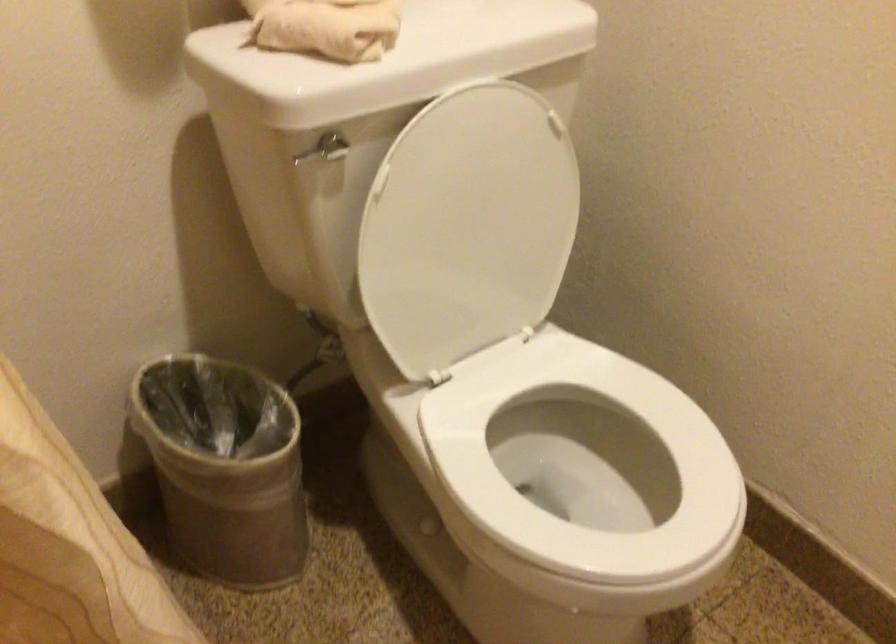
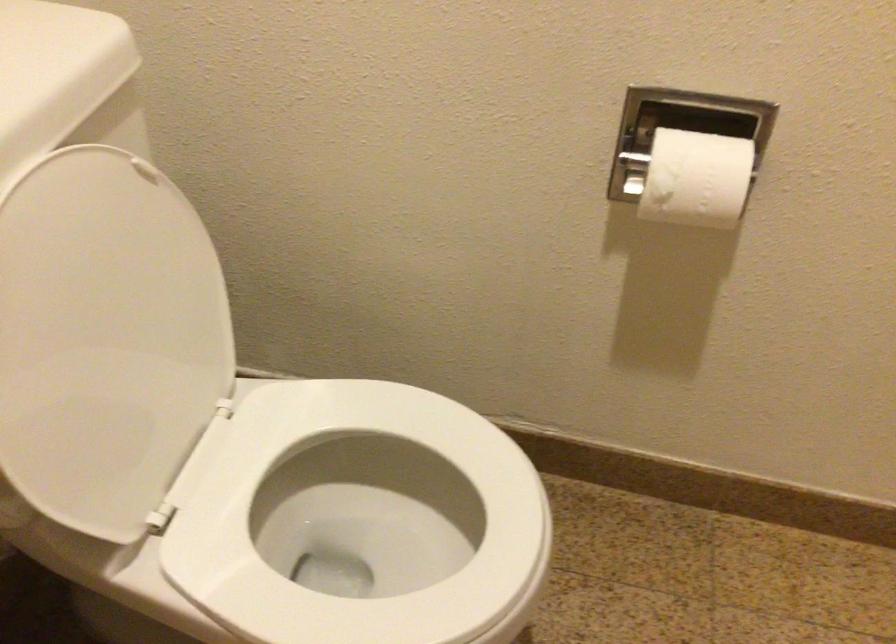
Question: The camera is either moving clockwise (left) or counter-clockwise (right) around the object. The first image is from the beginning of the video and the second image is from the end. Is the camera moving left or right when shooting the video?

Choices:
 (A) Left
 (B) Right

Answer: (A)